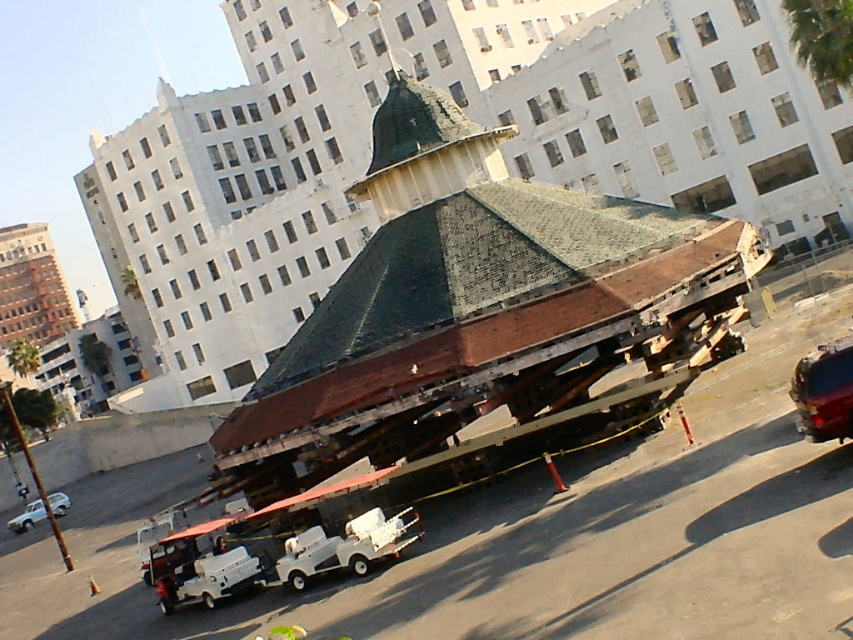
Does green leafy palm tree at upper right appear under white matte golf cart at lower left?

Actually, green leafy palm tree at upper right is above white matte golf cart at lower left.

Who is positioned more to the left, green leafy palm tree at upper right or white matte golf cart at lower left?

white matte golf cart at lower left

Locate an element on the screen. This screenshot has height=640, width=853. green leafy palm tree at upper right is located at coordinates (822, 36).

Is rusty metal gazebo at center smaller than metallic red suv at right?

Incorrect, rusty metal gazebo at center is not smaller in size than metallic red suv at right.

Is rusty metal gazebo at center above metallic red suv at right?

Yes.

Measure the distance between rusty metal gazebo at center and camera.

They are 20.93 meters apart.

Identify the location of rusty metal gazebo at center. (485, 317).

How far apart are metallic red suv at right and white matte golf cart at lower left?

metallic red suv at right is 41.39 feet away from white matte golf cart at lower left.

Does metallic red suv at right appear on the right side of white matte golf cart at lower left?

Indeed, metallic red suv at right is positioned on the right side of white matte golf cart at lower left.

Does point (840, 433) come in front of point (192, 596)?

Yes, it is.

What are the coordinates of `metallic red suv at right` in the screenshot? It's located at [824, 392].